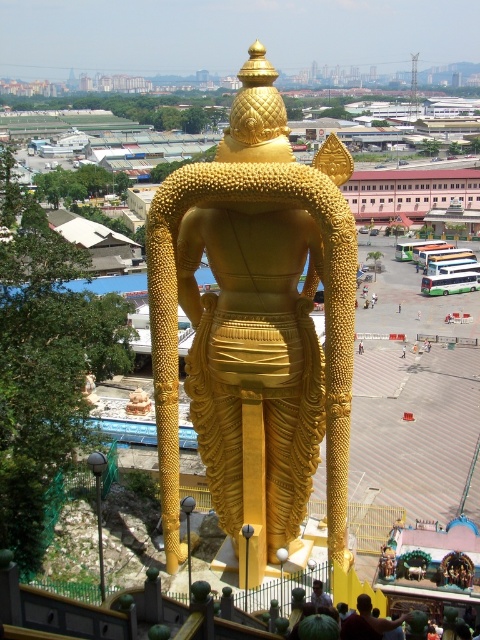
Between gold polished statue at center and light brown wooden chair at center, which one has more height?

gold polished statue at center

Based on the photo, can you confirm if gold polished statue at center is smaller than light brown wooden chair at center?

Actually, gold polished statue at center might be larger than light brown wooden chair at center.

Find the location of a particular element. This screenshot has width=480, height=640. gold polished statue at center is located at coordinates (255, 323).

Is gold polished statue at center taller than dark brown skin at lower center?

Yes, gold polished statue at center is taller than dark brown skin at lower center.

Who is more distant from viewer, (176, 173) or (356, 624)?

Point (176, 173)

Image resolution: width=480 pixels, height=640 pixels. Identify the location of gold polished statue at center. (255, 323).

Who is more forward, (359, 636) or (317, 580)?

Point (359, 636) is more forward.

Which is more to the left, dark brown skin at lower center or light brown wooden chair at center?

Positioned to the left is light brown wooden chair at center.

Find the location of `dark brown skin at lower center`. dark brown skin at lower center is located at coordinates (368, 621).